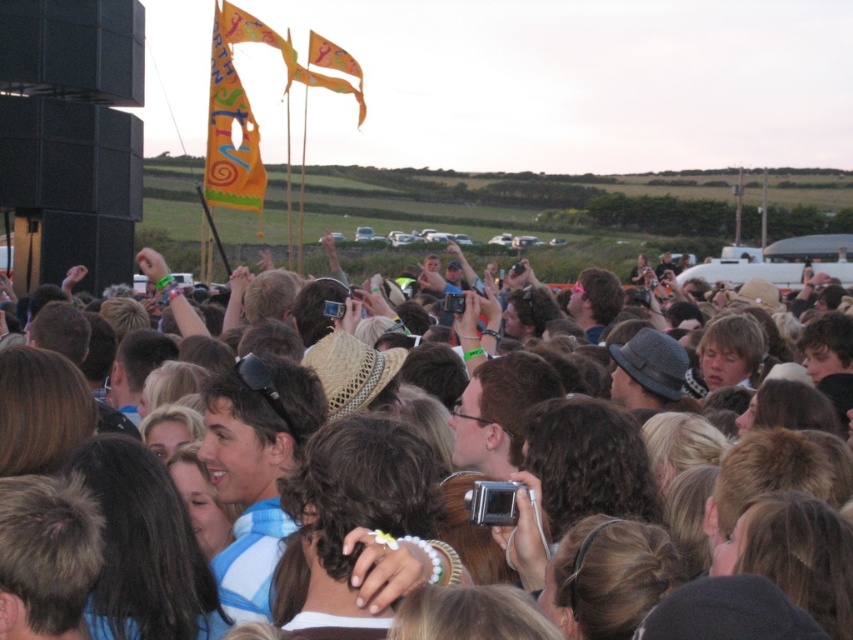
You are a photographer at the music festival. You want to take a photo that includes both the brown hair at center and the orange fabric flag at upper left. Which object should you focus on first to ensure both are in frame?

You should focus on the brown hair at center first because it is larger in size than the orange fabric flag at upper left, so it will require more attention to frame properly.

You are a photographer at the music festival and want to capture the brown hair at center and the orange fabric flag at upper left in the same frame. Based on their positions, which object should you adjust your camera to focus on first to ensure both are visible?

The brown hair at center is to the right of orange fabric flag at upper left, so you should focus on the orange fabric flag at upper left first to ensure both are visible in the frame.

You are a photographer at the music festival. You want to capture a photo that includes both the brown hair at center and the orange fabric flag at upper left. Which object should you focus on first if you want to ensure both are in frame?

The brown hair at center should be focused on first because its width is larger than the orange fabric flag at upper left, so adjusting the frame to accommodate its size will naturally include the smaller flag.